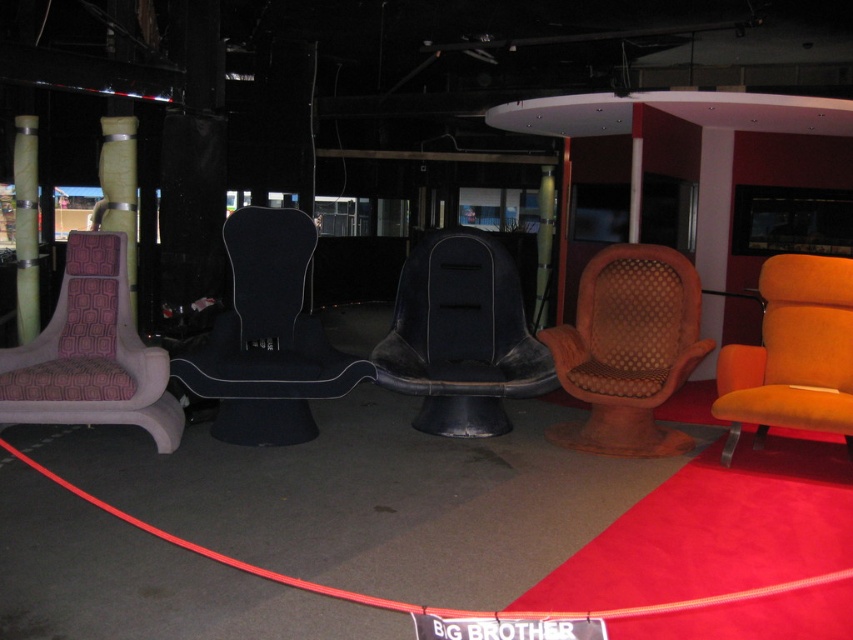
Question: Which object is farther from the camera taking this photo?

Choices:
 (A) black fabric chair at center
 (B) orange velvet armchair at center

Answer: (A)

Question: Is black leather chair at center wider than brown woven armchair at center?

Choices:
 (A) no
 (B) yes

Answer: (B)

Question: Is black fabric chair at center wider than orange velvet armchair at center?

Choices:
 (A) yes
 (B) no

Answer: (A)

Question: Is black leather chair at center to the left of brown woven armchair at center from the viewer's perspective?

Choices:
 (A) yes
 (B) no

Answer: (A)

Question: Which of the following is the farthest from the observer?

Choices:
 (A) (0, 371)
 (B) (395, 385)
 (C) (656, 392)

Answer: (B)

Question: Which of the following is the farthest from the observer?

Choices:
 (A) orange velvet armchair at center
 (B) brown woven armchair at center
 (C) purple fabric armchair at left
 (D) black fabric chair at center

Answer: (B)